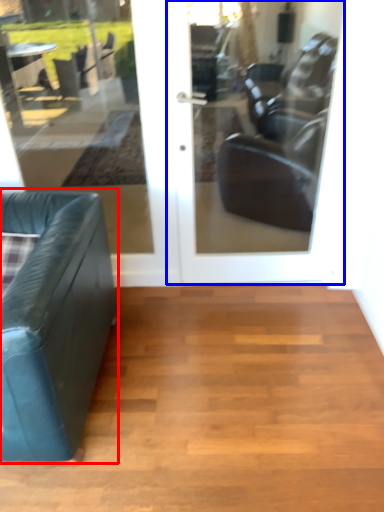
Question: Which object is closer to the camera taking this photo, studio couch (highlighted by a red box) or door (highlighted by a blue box)?

Choices:
 (A) studio couch
 (B) door

Answer: (A)